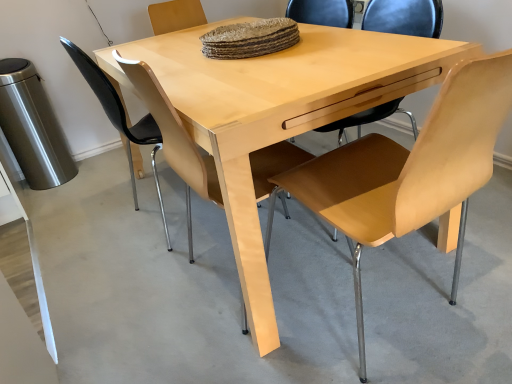
Find the location of a particular element. This screenshot has height=384, width=512. vacant space behind light brown leather chair at center, the 3th chair viewed from the right is located at coordinates (151, 185).